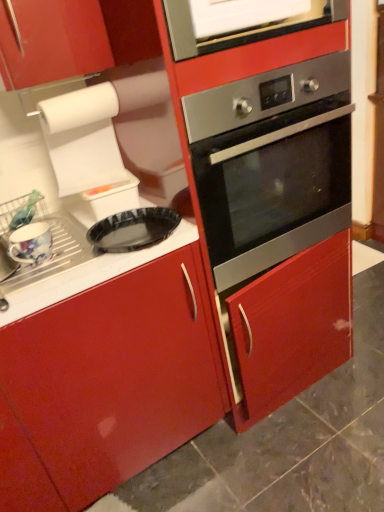
Question: From the image's perspective, would you say white glossy vent at upper center is shown under stainless steel oven at center?

Choices:
 (A) yes
 (B) no

Answer: (B)

Question: Is stainless steel oven at center inside white glossy vent at upper center?

Choices:
 (A) yes
 (B) no

Answer: (B)

Question: From the image's perspective, is white glossy vent at upper center on top of stainless steel oven at center?

Choices:
 (A) yes
 (B) no

Answer: (A)

Question: Could you tell me if white glossy vent at upper center is facing stainless steel oven at center?

Choices:
 (A) yes
 (B) no

Answer: (B)

Question: Is white glossy vent at upper center wider than stainless steel oven at center?

Choices:
 (A) yes
 (B) no

Answer: (B)

Question: Considering the positions of point (46, 245) and point (344, 10), is point (46, 245) closer or farther from the camera than point (344, 10)?

Choices:
 (A) farther
 (B) closer

Answer: (B)

Question: Considering the positions of floral ceramic mug at left and white glossy vent at upper center in the image, is floral ceramic mug at left taller or shorter than white glossy vent at upper center?

Choices:
 (A) short
 (B) tall

Answer: (A)

Question: Considering their positions, is floral ceramic mug at left located in front of or behind white glossy vent at upper center?

Choices:
 (A) front
 (B) behind

Answer: (B)

Question: Based on their positions, is floral ceramic mug at left located to the left or right of white glossy vent at upper center?

Choices:
 (A) right
 (B) left

Answer: (B)

Question: Based on their sizes in the image, would you say stainless steel oven at center is bigger or smaller than black glossy pizza pan at center?

Choices:
 (A) big
 (B) small

Answer: (A)

Question: Is stainless steel oven at center spatially inside black glossy pizza pan at center, or outside of it?

Choices:
 (A) outside
 (B) inside

Answer: (A)

Question: Does point (345, 120) appear closer or farther from the camera than point (172, 211)?

Choices:
 (A) closer
 (B) farther

Answer: (B)

Question: Is stainless steel oven at center to the left or to the right of black glossy pizza pan at center in the image?

Choices:
 (A) right
 (B) left

Answer: (A)

Question: From the image's perspective, is stainless steel oven at center positioned above or below white glossy vent at upper center?

Choices:
 (A) below
 (B) above

Answer: (A)

Question: In terms of height, does stainless steel oven at center look taller or shorter compared to white glossy vent at upper center?

Choices:
 (A) short
 (B) tall

Answer: (B)